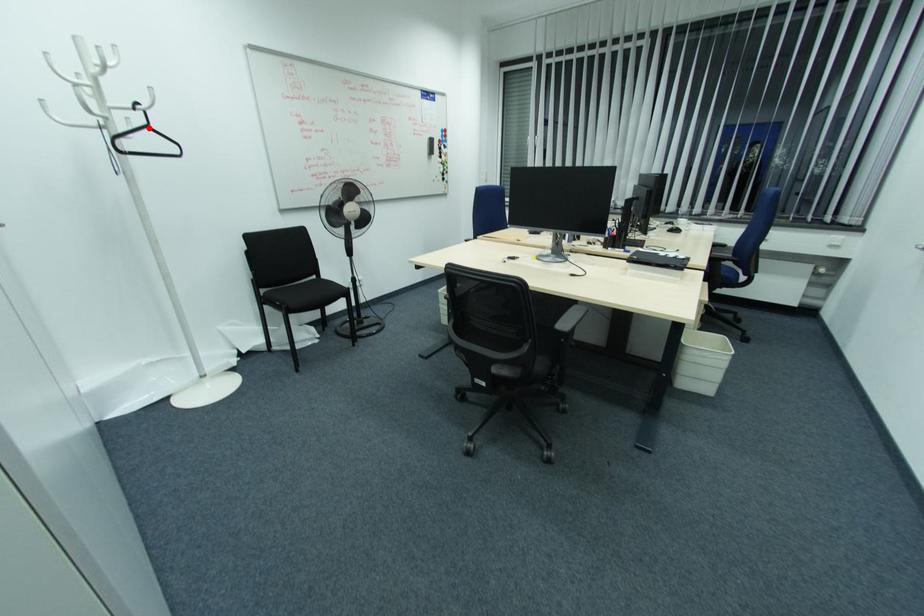
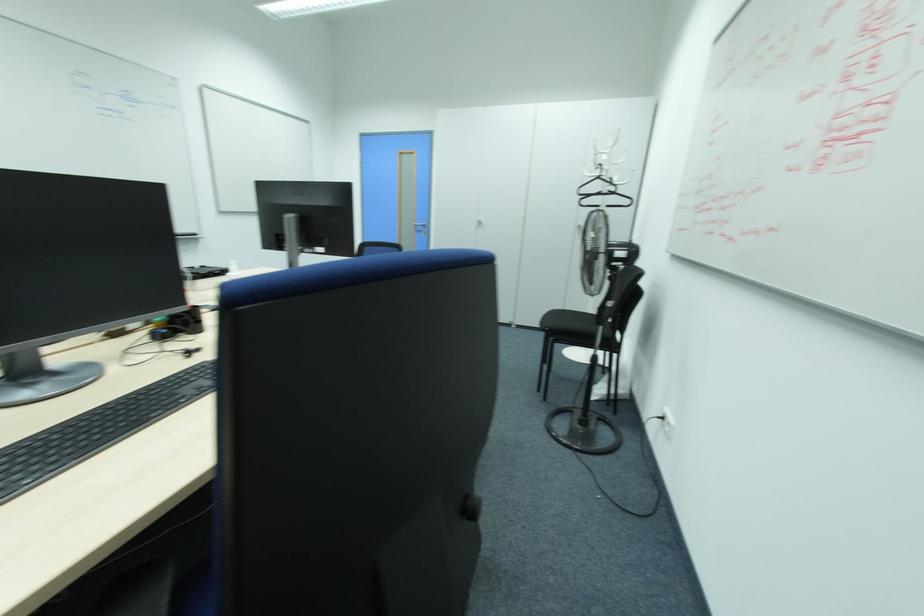
Locate, in the second image, the point that corresponds to the highlighted location in the first image.

(599, 177)